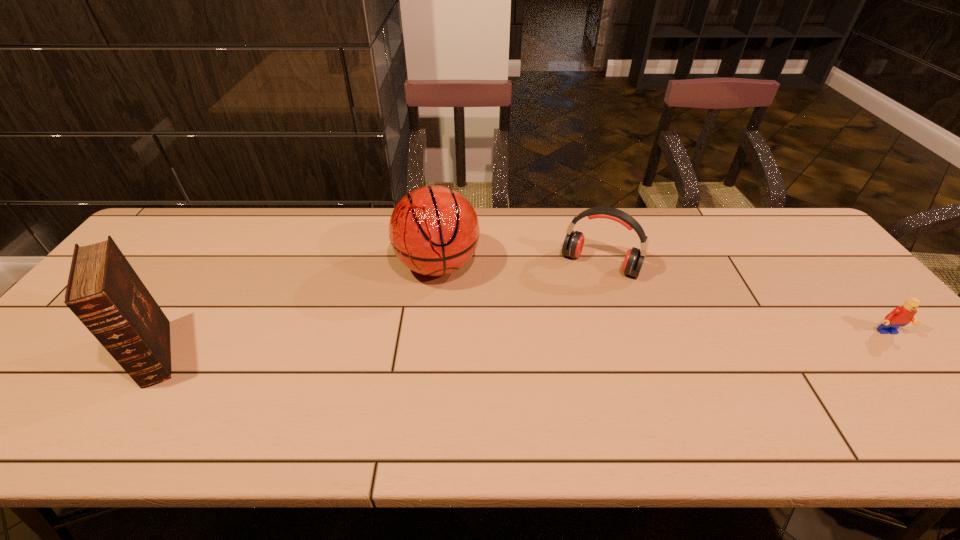
Locate an element on the screen. This screenshot has width=960, height=540. vacant spot on the desktop that is between the Bible and the rightmost object and is positioned on the ear cups of the second object from right to left is located at coordinates (564, 342).

This screenshot has width=960, height=540. In order to click on free space on the desktop that is between the Bible and the rightmost object and is positioned on the side with spill of the basketball in this screenshot , I will do `click(444, 346)`.